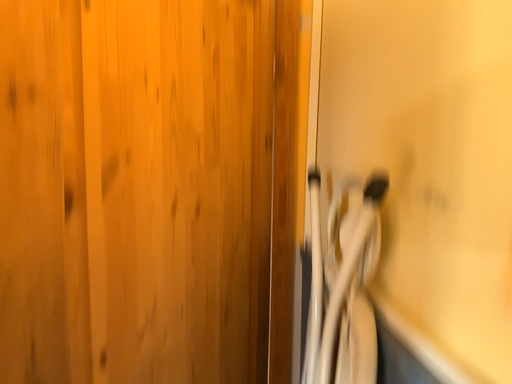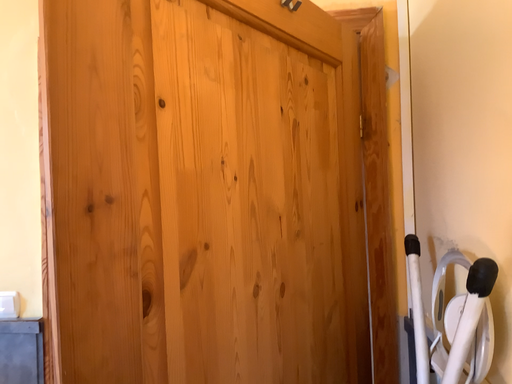
Question: Which way did the camera rotate in the video?

Choices:
 (A) rotated left
 (B) rotated right

Answer: (A)